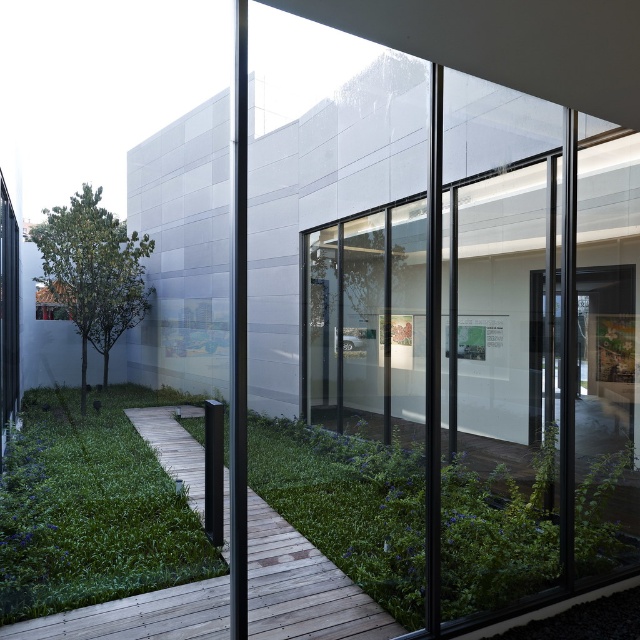
You are a gardener planning to mow the green grass at lower left and the wooden planks at center. Which area requires a wider mower to handle its width?

The green grass at lower left requires a wider mower because its width is greater than the wooden planks at center.

Consider the image. You are a visitor approaching the building and see the green grass at lower left and the wooden planks at center. Which one is closer to the entrance of the building?

The wooden planks at center are closer to the entrance of the building because they are positioned to the right of the green grass at lower left, which is further away.